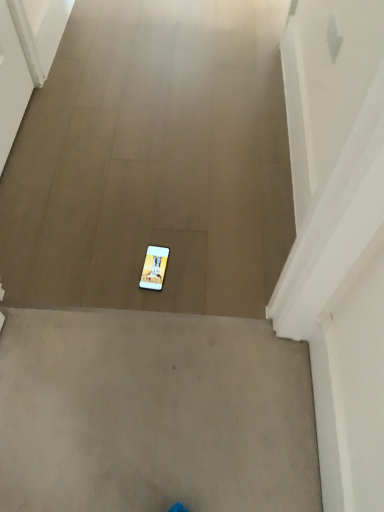
Locate an element on the screen. unoccupied space behind white glossy mobile phone at center is located at coordinates (157, 227).